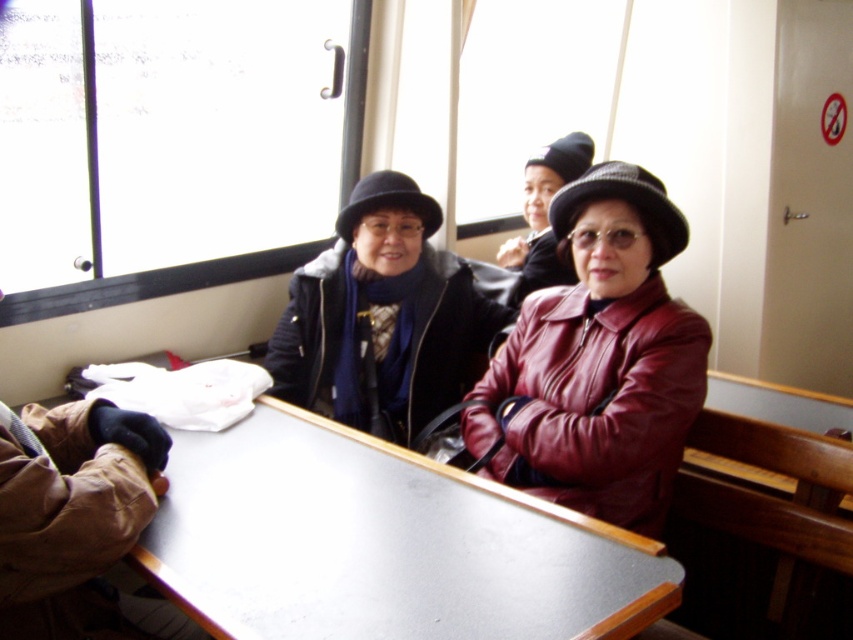
You are standing in the train cabin and want to place your backpack on the smooth gray table at center. Where should you look to find the table?

The smooth gray table at center is located at the coordinates 0.852 on the x axis and 0.449 on the y axis, so you should look towards those coordinates to find the table.

You are a photographer standing in the train cabin. You want to take a photo of the smooth gray table at center and the leather jacket at center. How far apart are these two items from each other?

The smooth gray table at center and the leather jacket at center are 16.90 inches apart.

You are a photographer standing at the back of the cabin. You want to take a photo of the smooth gray table at center and the leather jacket at center so that both are fully visible. Which object might block the view of the other?

The leather jacket at center is taller than the smooth gray table at center, so it might block the view of the table.